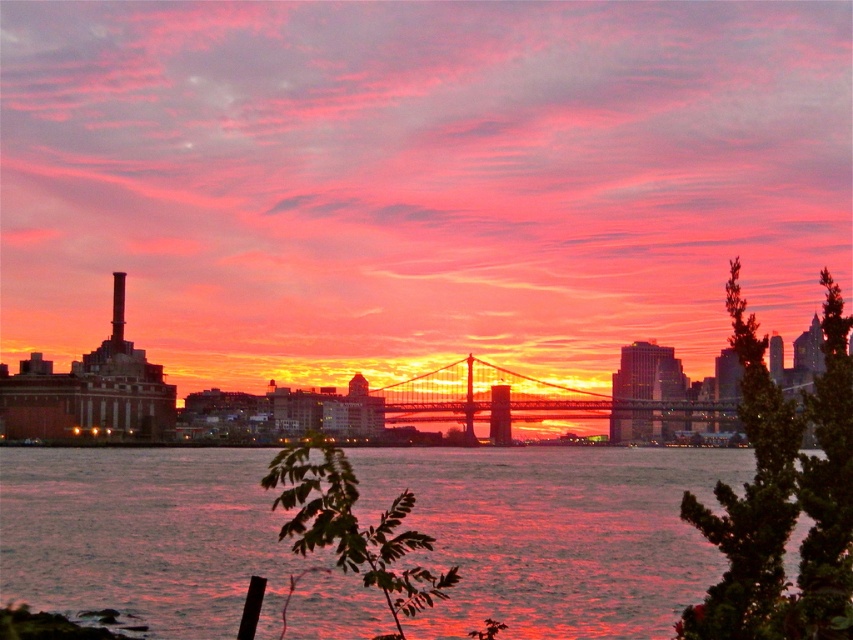
Image resolution: width=853 pixels, height=640 pixels. What do you see at coordinates (556, 532) in the screenshot?
I see `shiny metallic water at center` at bounding box center [556, 532].

Does shiny metallic water at center appear on the right side of metallic bridge at center?

In fact, shiny metallic water at center is to the left of metallic bridge at center.

Who is more distant from viewer, (x=576, y=582) or (x=705, y=412)?

The point (x=705, y=412) is more distant.

Locate an element on the screen. This screenshot has height=640, width=853. shiny metallic water at center is located at coordinates (556, 532).